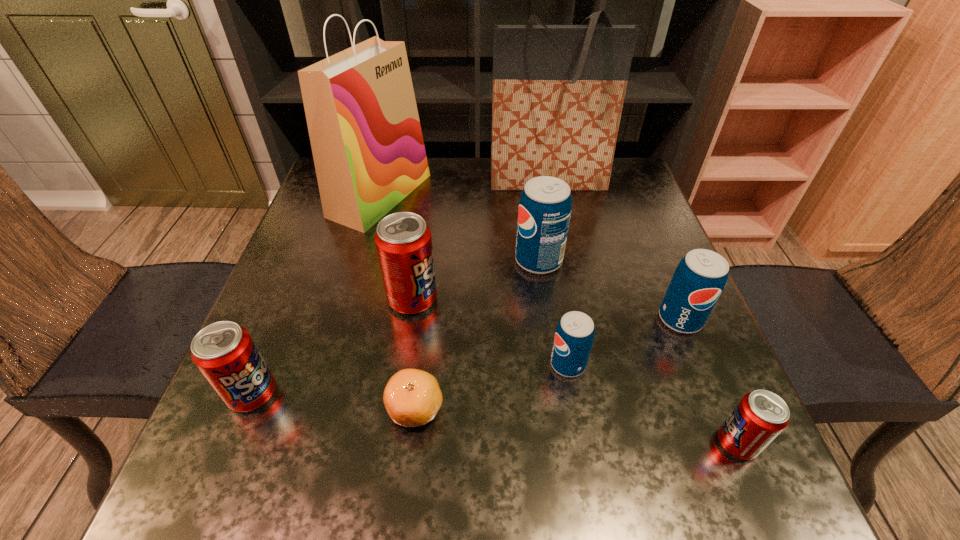
Locate an element on the screen. The width and height of the screenshot is (960, 540). free area in between the left shopping bag and the right shopping bag is located at coordinates (464, 188).

This screenshot has width=960, height=540. I want to click on empty space between the second smallest red soda can and the farthest red soda can, so click(333, 346).

Locate an element on the screen. The height and width of the screenshot is (540, 960). vacant area that lies between the farthest soda can and the orange clementine is located at coordinates (477, 334).

The image size is (960, 540). What are the coordinates of `free space between the biggest blue pop and the second smallest red soda can` in the screenshot? It's located at (396, 327).

The height and width of the screenshot is (540, 960). I want to click on the fifth closest object relative to the nearest blue pop, so click(x=403, y=241).

Where is `object that is the eighth closest one to the nearest soda can`? The height and width of the screenshot is (540, 960). object that is the eighth closest one to the nearest soda can is located at coordinates (224, 352).

Locate which soda can ranks fifth in proximity to the farthest soda can. Please provide its 2D coordinates. Your answer should be formatted as a tuple, i.e. [(x, y)], where the tuple contains the x and y coordinates of a point satisfying the conditions above.

[(224, 352)]

Where is `soda can that can be found as the closest to the clementine`? The height and width of the screenshot is (540, 960). soda can that can be found as the closest to the clementine is located at coordinates (403, 241).

Where is `the closest blue pop relative to the left shopping bag`? The height and width of the screenshot is (540, 960). the closest blue pop relative to the left shopping bag is located at coordinates (545, 206).

Locate an element on the screen. This screenshot has width=960, height=540. blue pop that can be found as the second closest to the smallest blue pop is located at coordinates (545, 206).